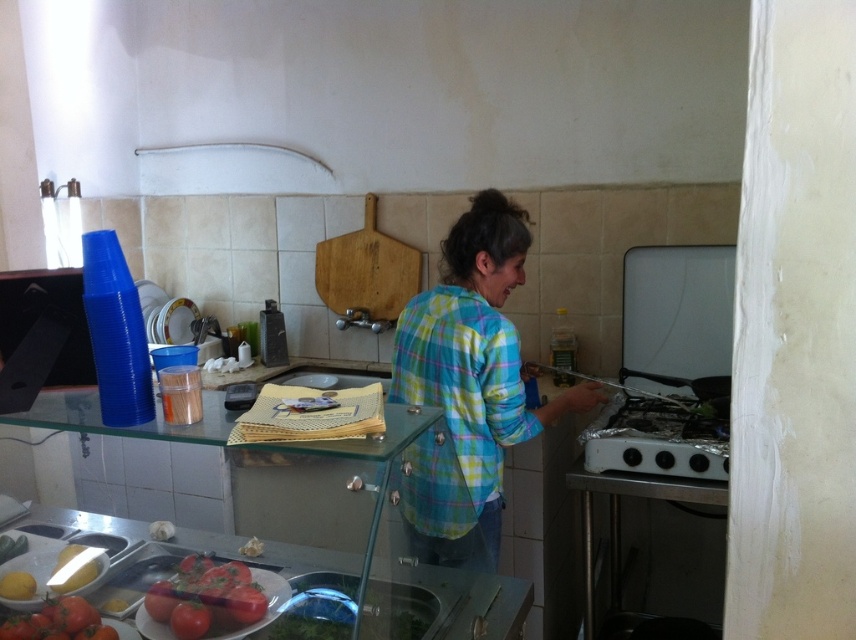
Is point (238, 145) more distant than point (176, 621)?

Yes, it is behind point (176, 621).

Which is behind, point (248, 148) or point (180, 625)?

The point (248, 148) is more distant.

Image resolution: width=856 pixels, height=640 pixels. What do you see at coordinates (236, 148) in the screenshot? I see `white matte exhaust hood at upper center` at bounding box center [236, 148].

Image resolution: width=856 pixels, height=640 pixels. What are the coordinates of `white matte exhaust hood at upper center` in the screenshot? It's located at (236, 148).

Who is taller, silver metallic gas stove at lower right or shiny red tomatoes at lower left?

silver metallic gas stove at lower right is taller.

Is silver metallic gas stove at lower right thinner than shiny red tomatoes at lower left?

In fact, silver metallic gas stove at lower right might be wider than shiny red tomatoes at lower left.

Between point (603, 436) and point (182, 636), which one is positioned behind?

The point (603, 436) is behind.

This screenshot has width=856, height=640. What are the coordinates of `silver metallic gas stove at lower right` in the screenshot? It's located at (652, 440).

Is plaid cotton shirt at center smaller than metallic stainless steel counter at lower center?

Actually, plaid cotton shirt at center might be larger than metallic stainless steel counter at lower center.

Which of these two, plaid cotton shirt at center or metallic stainless steel counter at lower center, stands shorter?

Standing shorter between the two is metallic stainless steel counter at lower center.

Between point (452, 337) and point (296, 557), which one is positioned in front?

Point (296, 557) is more forward.

At what (x,y) coordinates should I click in order to perform the action: click on plaid cotton shirt at center. Please return your answer as a coordinate pair (x, y). This screenshot has height=640, width=856. Looking at the image, I should click on (456, 404).